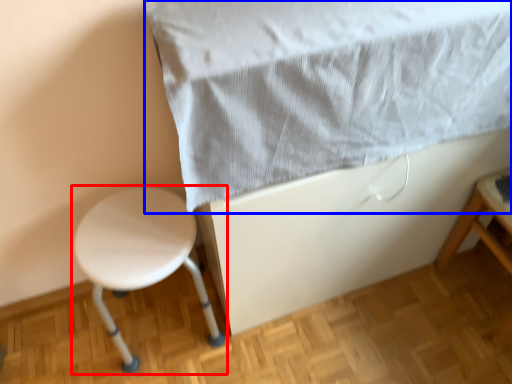
Question: Among these objects, which one is farthest to the camera, stool (highlighted by a red box) or sheet (highlighted by a blue box)?

Choices:
 (A) stool
 (B) sheet

Answer: (A)